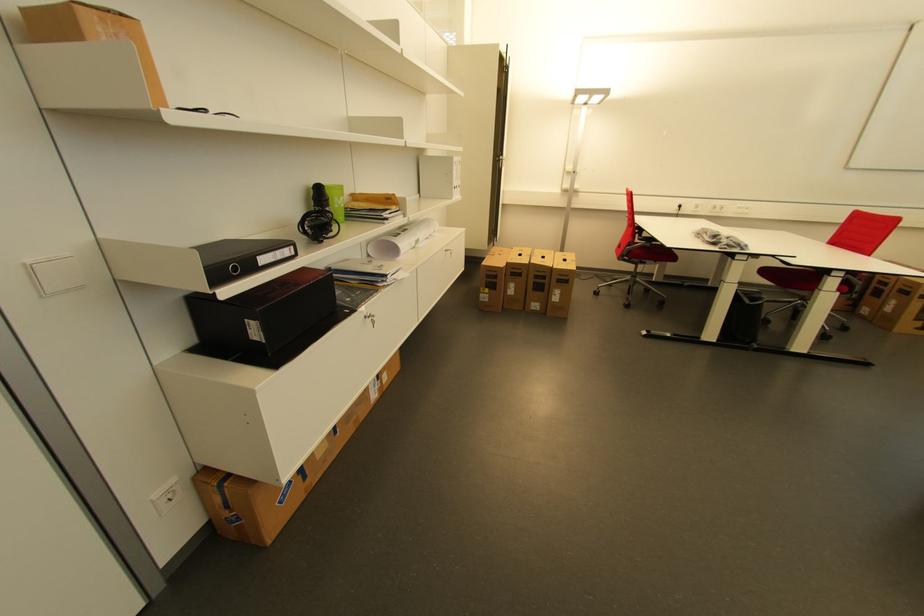
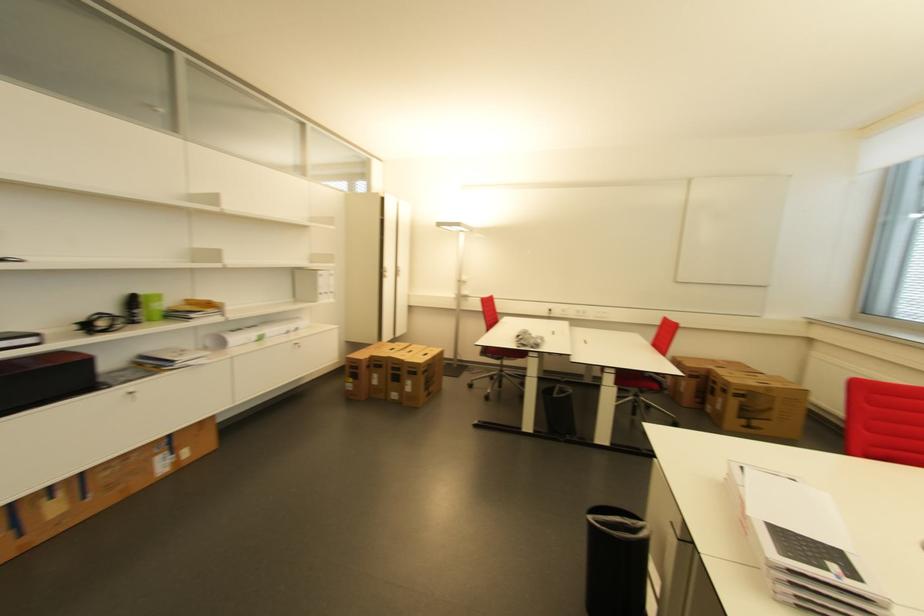
Find the pixel in the second image that matches (502,278) in the first image.

(362, 369)